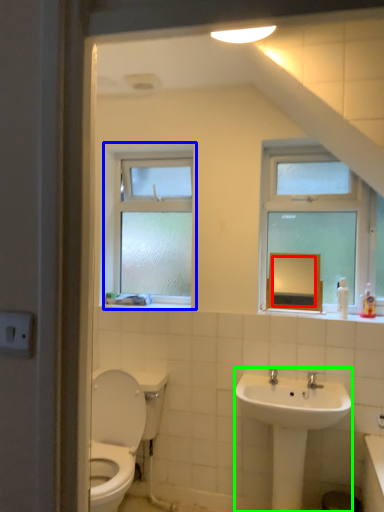
Question: Estimate the real-world distances between objects in this image. Which object is farther from mirror (highlighted by a red box), window (highlighted by a blue box) or sink (highlighted by a green box)?

Choices:
 (A) window
 (B) sink

Answer: (A)